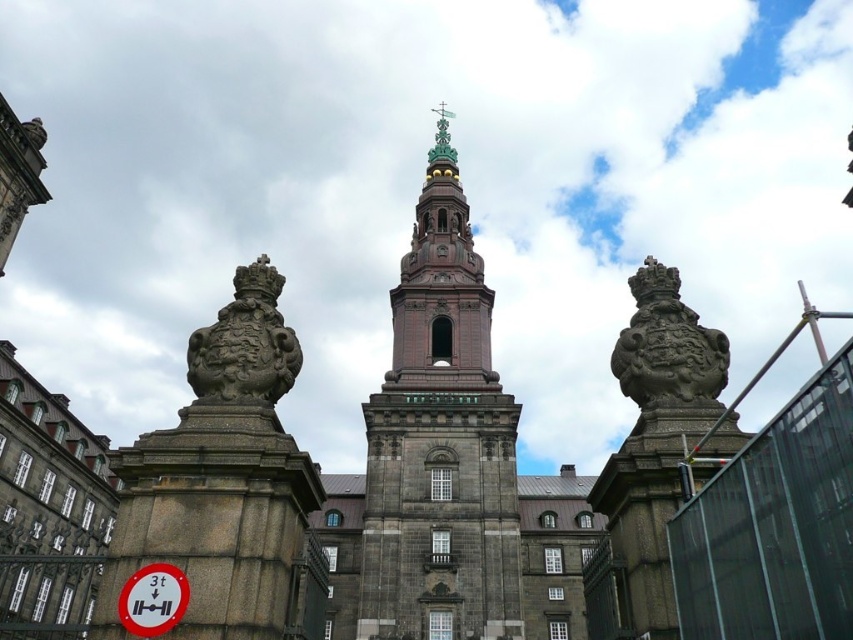
Question: Can you confirm if stone carved emblem at center is positioned below white plastic sign at lower left?

Choices:
 (A) no
 (B) yes

Answer: (A)

Question: Which point is farther from the camera taking this photo?

Choices:
 (A) (666, 394)
 (B) (131, 611)
 (C) (480, 548)

Answer: (C)

Question: Which of the following is the farthest from the observer?

Choices:
 (A) dark gray stone tower at center
 (B) white plastic sign at lower left
 (C) stone carved emblem at center
 (D) gray stone sculpture at center

Answer: (A)

Question: Can you confirm if dark gray stone tower at center is thinner than white plastic sign at lower left?

Choices:
 (A) no
 (B) yes

Answer: (A)

Question: Considering the real-world distances, which object is closest to the gray stone sculpture at center?

Choices:
 (A) dark gray stone tower at center
 (B) stone carved emblem at center

Answer: (B)

Question: Can you confirm if dark gray stone tower at center is positioned to the left of stone carved emblem at center?

Choices:
 (A) yes
 (B) no

Answer: (B)